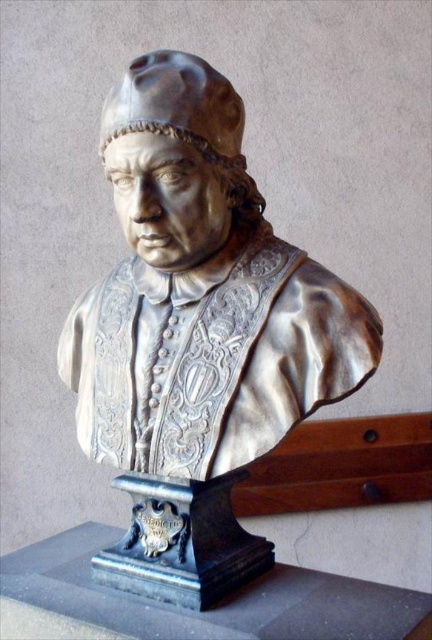
Who is positioned more to the left, shiny bronze bust at center or matte silver skull at center?

matte silver skull at center is more to the left.

Measure the distance between point (186, 472) and camera.

Point (186, 472) and camera are 3.31 feet apart.

At what (x,y) coordinates should I click in order to perform the action: click on shiny bronze bust at center. Please return your answer as a coordinate pair (x, y). Image resolution: width=432 pixels, height=640 pixels. Looking at the image, I should click on (197, 333).